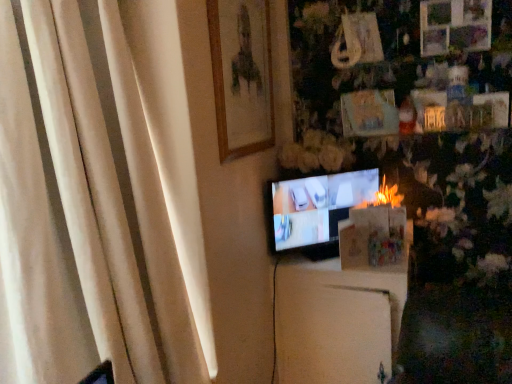
What do you see at coordinates (316, 207) in the screenshot? I see `matte black tv at center` at bounding box center [316, 207].

What is the approximate width of wooden framed portrait at upper center?

It is 1.64 inches.

In order to face white fabric curtain at left, should I rotate leftwards or rightwards?

Rotate left and turn 20.219 degrees.

Locate an element on the screen. The height and width of the screenshot is (384, 512). matte black tv at center is located at coordinates (316, 207).

Considering the relative sizes of matte black tv at center and white fabric curtain at left in the image provided, is matte black tv at center taller than white fabric curtain at left?

No, matte black tv at center is not taller than white fabric curtain at left.

Is white fabric curtain at left inside matte black tv at center?

No, white fabric curtain at left is not surrounded by matte black tv at center.

Based on the photo, from a real-world perspective, between matte black tv at center and white fabric curtain at left, who is vertically lower?

matte black tv at center.

Is white matte cabinet at center taller than matte black tv at center?

Correct, white matte cabinet at center is much taller as matte black tv at center.

From a real-world perspective, is white matte cabinet at center under matte black tv at center?

Correct, in the physical world, white matte cabinet at center is lower than matte black tv at center.

Is white matte cabinet at center oriented towards matte black tv at center?

No, white matte cabinet at center is not aimed at matte black tv at center.

Is point (373, 306) positioned behind point (361, 175)?

That is False.

Is wooden framed portrait at upper center inside or outside of white fabric curtain at left?

wooden framed portrait at upper center exists outside the volume of white fabric curtain at left.

From a real-world perspective, does wooden framed portrait at upper center stand above white fabric curtain at left?

Correct, in the physical world, wooden framed portrait at upper center is higher than white fabric curtain at left.

Locate an element on the screen. picture frame on the right side of white fabric curtain at left is located at coordinates (241, 75).

From a real-world perspective, is white fabric curtain at left above or below white matte cabinet at center?

In terms of real-world spatial position, white fabric curtain at left is above white matte cabinet at center.

Considering the relative sizes of white fabric curtain at left and white matte cabinet at center in the image provided, is white fabric curtain at left thinner than white matte cabinet at center?

Correct, the width of white fabric curtain at left is less than that of white matte cabinet at center.

From the picture: Does white fabric curtain at left have a greater height compared to white matte cabinet at center?

Correct, white fabric curtain at left is much taller as white matte cabinet at center.

In the scene shown: From a real-world perspective, is white matte cabinet at center beneath wooden framed portrait at upper center?

Yes, from a real-world perspective, white matte cabinet at center is below wooden framed portrait at upper center.

Are white matte cabinet at center and wooden framed portrait at upper center far apart?

Actually, white matte cabinet at center and wooden framed portrait at upper center are a little close together.

Considering the relative sizes of white matte cabinet at center and wooden framed portrait at upper center in the image provided, is white matte cabinet at center shorter than wooden framed portrait at upper center?

In fact, white matte cabinet at center may be taller than wooden framed portrait at upper center.

From the image's perspective, which is above, white matte cabinet at center or white fabric curtain at left?

white fabric curtain at left is shown above in the image.

Is white matte cabinet at center positioned beyond the bounds of white fabric curtain at left?

Yes, white matte cabinet at center is located beyond the bounds of white fabric curtain at left.

Considering the sizes of objects white matte cabinet at center and white fabric curtain at left in the image provided, who is thinner, white matte cabinet at center or white fabric curtain at left?

Thinner between the two is white fabric curtain at left.

In the scene shown: Between white matte cabinet at center and white fabric curtain at left, which one has more height?

white fabric curtain at left is taller.

Does wooden framed portrait at upper center have a greater height compared to matte black tv at center?

Yes, wooden framed portrait at upper center is taller than matte black tv at center.

Does wooden framed portrait at upper center contain matte black tv at center?

Definitely not — matte black tv at center is not inside wooden framed portrait at upper center.

Considering their positions, is wooden framed portrait at upper center located in front of or behind matte black tv at center?

wooden framed portrait at upper center is positioned closer to the viewer than matte black tv at center.

Is point (208, 12) closer to camera compared to point (341, 200)?

Yes.

Image resolution: width=512 pixels, height=384 pixels. Find the location of `curtain in front of the matte black tv at center`. curtain in front of the matte black tv at center is located at coordinates (96, 196).

Where is `furniture lying on the right of matte black tv at center`? The width and height of the screenshot is (512, 384). furniture lying on the right of matte black tv at center is located at coordinates (336, 321).

Looking at the image, which one is located further to white matte cabinet at center, white fabric curtain at left or matte black tv at center?

white fabric curtain at left lies further to white matte cabinet at center than the other object.

Which object lies further to the anchor point white matte cabinet at center, matte black tv at center or white fabric curtain at left?

Among the two, white fabric curtain at left is located further to white matte cabinet at center.

Based on their spatial positions, is white matte cabinet at center or wooden framed portrait at upper center closer to white fabric curtain at left?

Among the two, wooden framed portrait at upper center is located nearer to white fabric curtain at left.

From the image, which object appears to be farther from white matte cabinet at center, white fabric curtain at left or wooden framed portrait at upper center?

white fabric curtain at left.

When comparing their distances from matte black tv at center, does wooden framed portrait at upper center or white matte cabinet at center seem further?

wooden framed portrait at upper center is further to matte black tv at center.

From the image, which object appears to be farther from white fabric curtain at left, wooden framed portrait at upper center or matte black tv at center?

matte black tv at center is positioned further to the anchor white fabric curtain at left.

Consider the image. When comparing their distances from white fabric curtain at left, does matte black tv at center or white matte cabinet at center seem closer?

matte black tv at center is closer to white fabric curtain at left.

Based on the photo, based on their spatial positions, is white matte cabinet at center or matte black tv at center further from wooden framed portrait at upper center?

white matte cabinet at center is positioned further to the anchor wooden framed portrait at upper center.

The width and height of the screenshot is (512, 384). In order to click on picture frame between white fabric curtain at left and matte black tv at center from front to back in this screenshot , I will do `click(241, 75)`.

Locate an element on the screen. The height and width of the screenshot is (384, 512). curtain between wooden framed portrait at upper center and white matte cabinet at center in the vertical direction is located at coordinates (96, 196).

Identify the location of television between wooden framed portrait at upper center and white matte cabinet at center from top to bottom. The width and height of the screenshot is (512, 384). (316, 207).

Where is `furniture located between white fabric curtain at left and matte black tv at center in the depth direction`? This screenshot has height=384, width=512. furniture located between white fabric curtain at left and matte black tv at center in the depth direction is located at coordinates (336, 321).